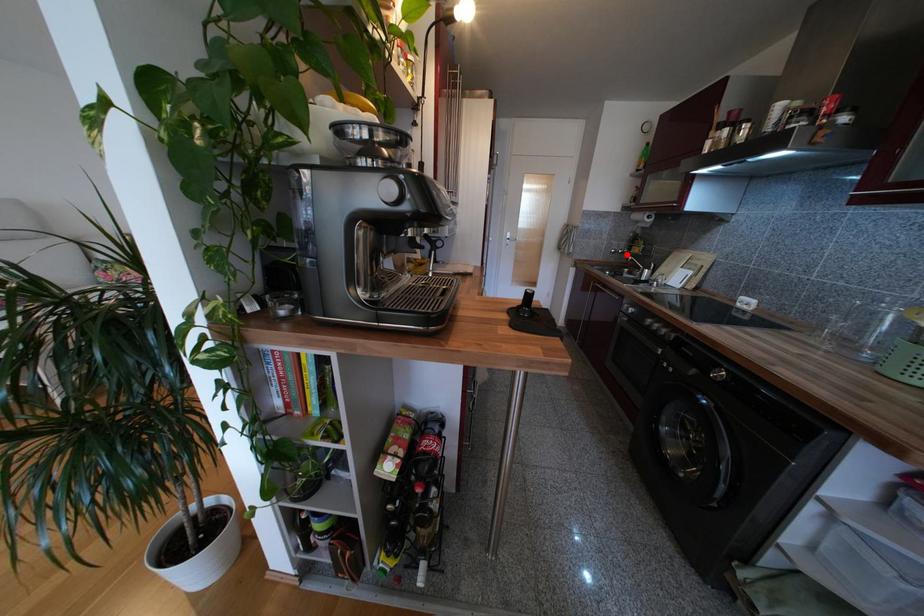
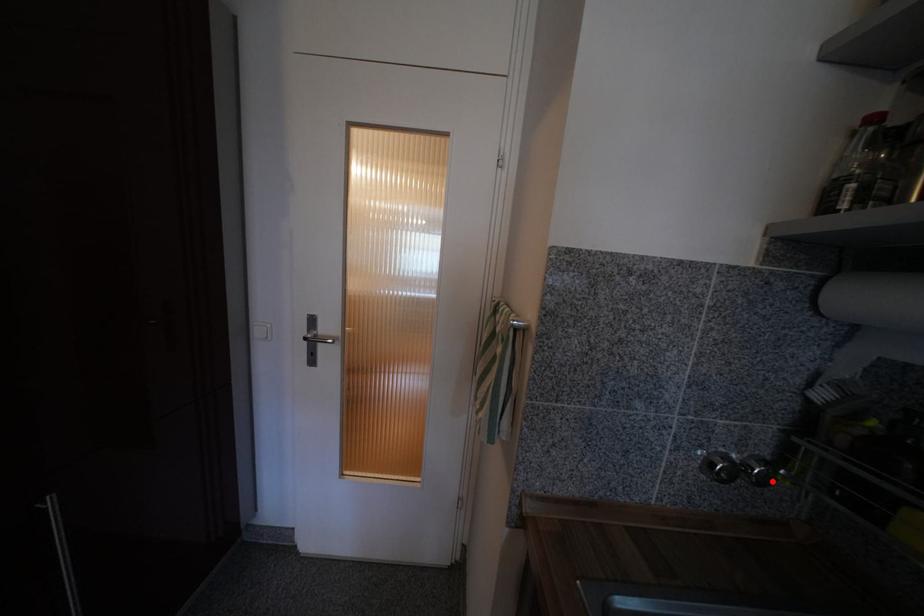
I am providing you with two images of the same scene from different viewpoints. A red point is marked on the first image and another point is marked on the second image. Is the marked point in image1 the same physical position as the marked point in image2?

Yes